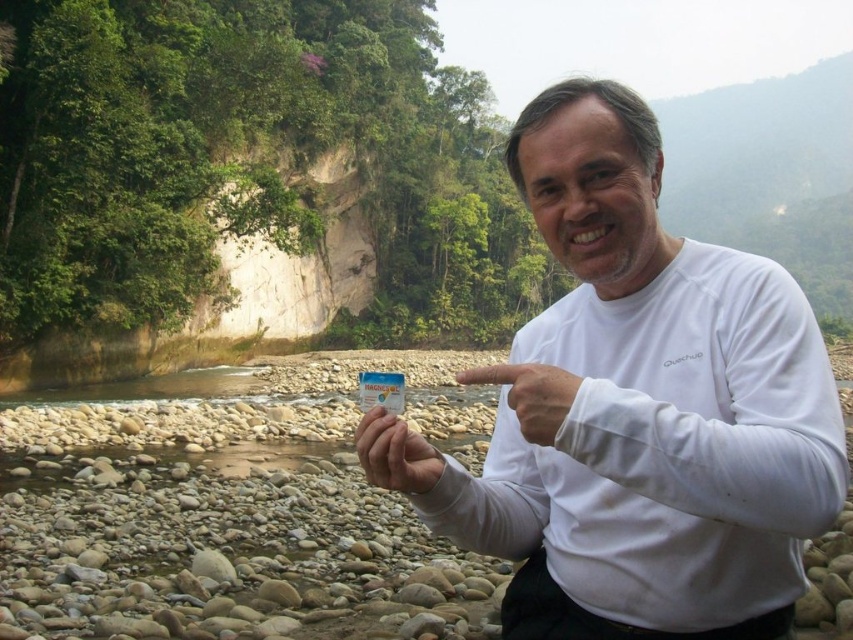
Question: Is the position of white matte shirt at center less distant than that of white matte hand at center?

Choices:
 (A) no
 (B) yes

Answer: (B)

Question: Which object is farther from the camera taking this photo?

Choices:
 (A) white matte shirt at center
 (B) white matte hand at center

Answer: (B)

Question: Does white matte shirt at center appear under white matte card at center?

Choices:
 (A) yes
 (B) no

Answer: (B)

Question: Which of the following is the closest to the observer?

Choices:
 (A) white matte card at center
 (B) white matte hand at center

Answer: (B)

Question: Does white matte shirt at center have a lesser width compared to white matte card at center?

Choices:
 (A) no
 (B) yes

Answer: (A)

Question: Among these points, which one is farthest from the camera?

Choices:
 (A) (672, 316)
 (B) (523, 397)

Answer: (A)